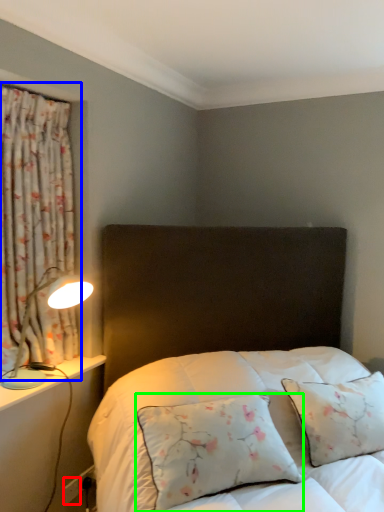
Question: Which is nearer to the electric outlet (highlighted by a red box)? curtain (highlighted by a blue box) or pillow (highlighted by a green box).

Choices:
 (A) curtain
 (B) pillow

Answer: (B)